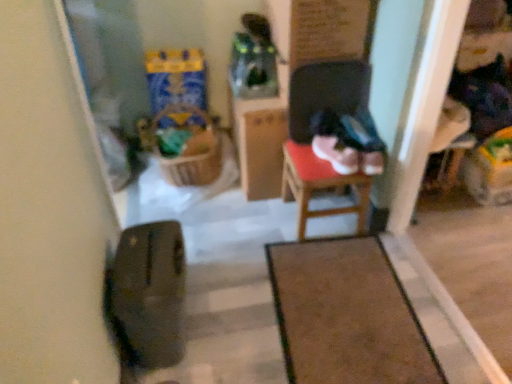
Question: Does brown carpet at center have a greater height compared to woven brown laundry basket at center?

Choices:
 (A) no
 (B) yes

Answer: (A)

Question: Is brown carpet at center looking in the opposite direction of woven brown laundry basket at center?

Choices:
 (A) yes
 (B) no

Answer: (B)

Question: From a real-world perspective, is brown carpet at center physically below woven brown laundry basket at center?

Choices:
 (A) no
 (B) yes

Answer: (B)

Question: Is brown carpet at center closer to the viewer compared to woven brown laundry basket at center?

Choices:
 (A) yes
 (B) no

Answer: (A)

Question: Are brown carpet at center and woven brown laundry basket at center beside each other?

Choices:
 (A) no
 (B) yes

Answer: (A)

Question: Does brown carpet at center have a smaller size compared to woven brown laundry basket at center?

Choices:
 (A) no
 (B) yes

Answer: (B)

Question: Is wooden armchair at right located within brown carpet at center?

Choices:
 (A) yes
 (B) no

Answer: (B)

Question: From a real-world perspective, is brown carpet at center physically above wooden armchair at right?

Choices:
 (A) yes
 (B) no

Answer: (B)

Question: From a real-world perspective, is brown carpet at center physically below wooden armchair at right?

Choices:
 (A) yes
 (B) no

Answer: (A)

Question: From the image's perspective, is brown carpet at center located above wooden armchair at right?

Choices:
 (A) yes
 (B) no

Answer: (B)

Question: Can you confirm if brown carpet at center is positioned to the right of wooden armchair at right?

Choices:
 (A) no
 (B) yes

Answer: (A)

Question: Is brown carpet at center thinner than wooden armchair at right?

Choices:
 (A) yes
 (B) no

Answer: (B)

Question: From a real-world perspective, is wooden chair at center under transparent glass door at left?

Choices:
 (A) yes
 (B) no

Answer: (A)